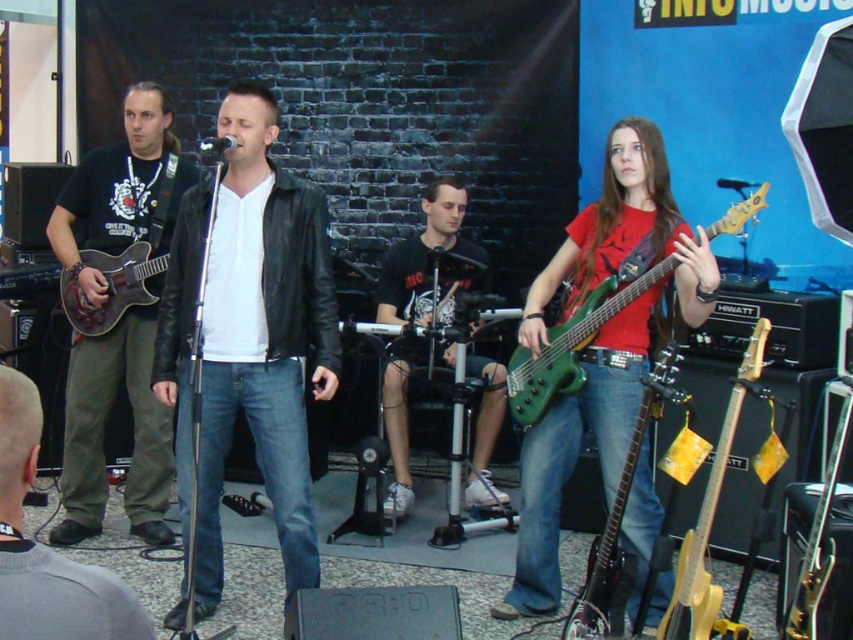
Question: Is black leather jacket at center to the left of dark brown leather pants at lower left from the viewer's perspective?

Choices:
 (A) yes
 (B) no

Answer: (B)

Question: Which point is closer to the camera taking this photo?

Choices:
 (A) (134, 109)
 (B) (850, 390)
 (C) (55, 570)
 (D) (695, 589)

Answer: (C)

Question: Considering the relative positions of matte black guitar at left and black matte shirt at center in the image provided, where is matte black guitar at left located with respect to black matte shirt at center?

Choices:
 (A) above
 (B) below

Answer: (A)

Question: Where is black matte shirt at center located in relation to green glossy electric guitar at center in the image?

Choices:
 (A) right
 (B) left

Answer: (B)

Question: Which point appears farthest from the camera in this image?

Choices:
 (A) (552, 392)
 (B) (148, 406)
 (C) (114, 269)
 (D) (706, 496)

Answer: (B)

Question: Which of the following is the farthest from the observer?

Choices:
 (A) (543, 381)
 (B) (67, 273)

Answer: (B)